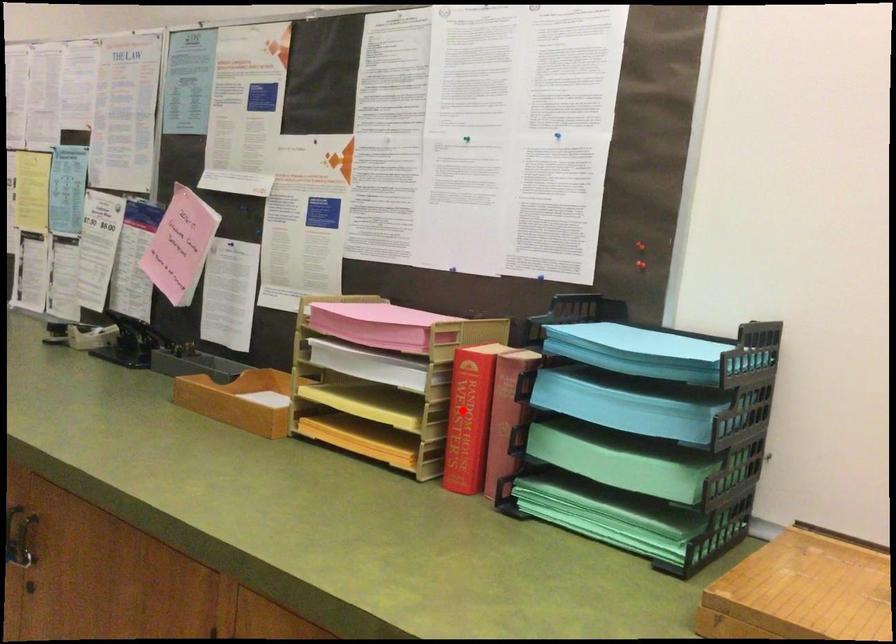
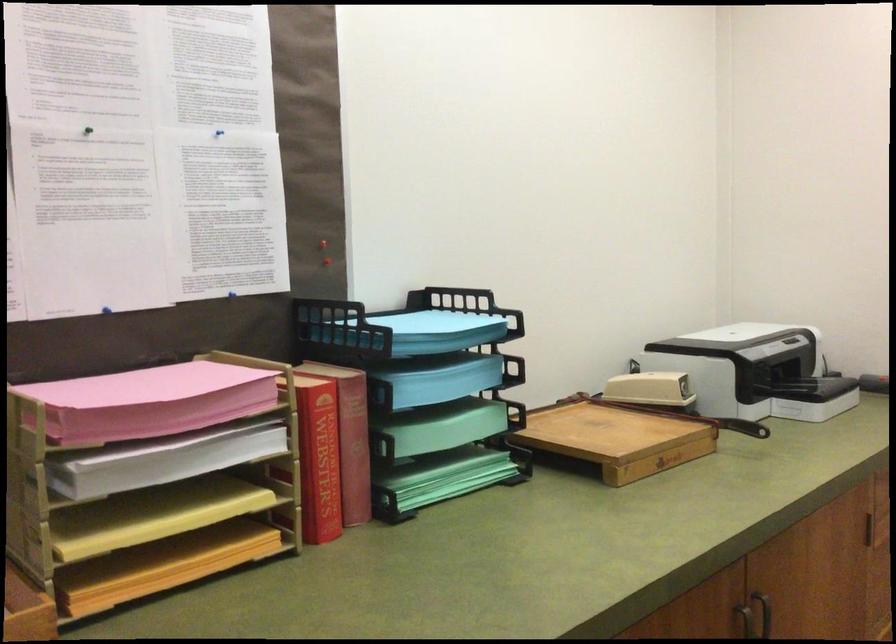
In the second image, find the point that corresponds to the highlighted location in the first image.

(319, 456)